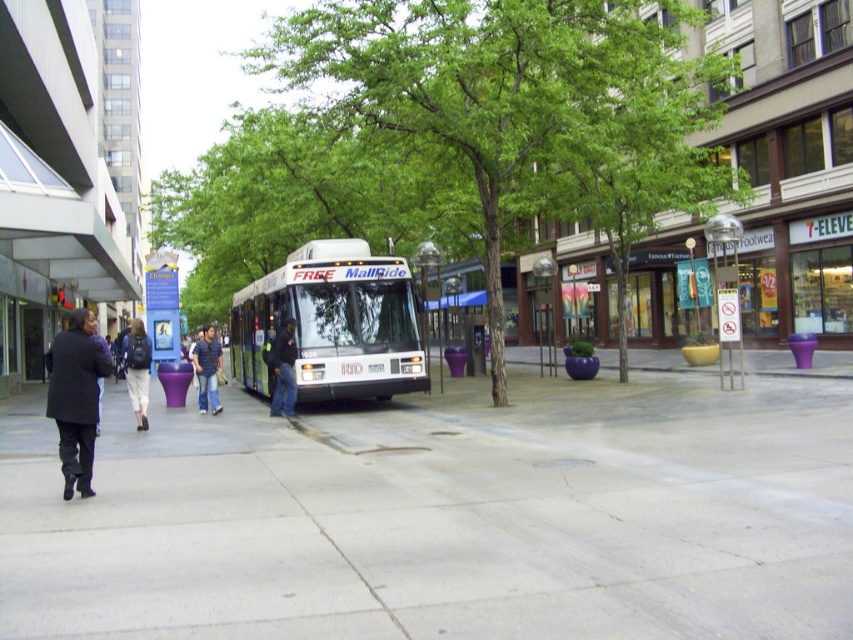
Question: Which of the following is the farthest from the observer?

Choices:
 (A) (728, 497)
 (B) (216, 342)

Answer: (B)

Question: Does green leafy tree at center appear on the left side of black matte coat at left?

Choices:
 (A) yes
 (B) no

Answer: (B)

Question: Based on their relative distances, which object is farther from the denim jacket at center?

Choices:
 (A) dark blue jeans at center
 (B) light beige pants at center

Answer: (B)

Question: Can you confirm if green leafy tree at center is positioned to the right of white metallic bus at center?

Choices:
 (A) yes
 (B) no

Answer: (A)

Question: Is dark blue jeans at center smaller than denim jacket at center?

Choices:
 (A) no
 (B) yes

Answer: (B)

Question: Which of the following is the closest to the observer?

Choices:
 (A) dark blue jeans at center
 (B) green leafy tree at center
 (C) white metallic bus at center

Answer: (B)